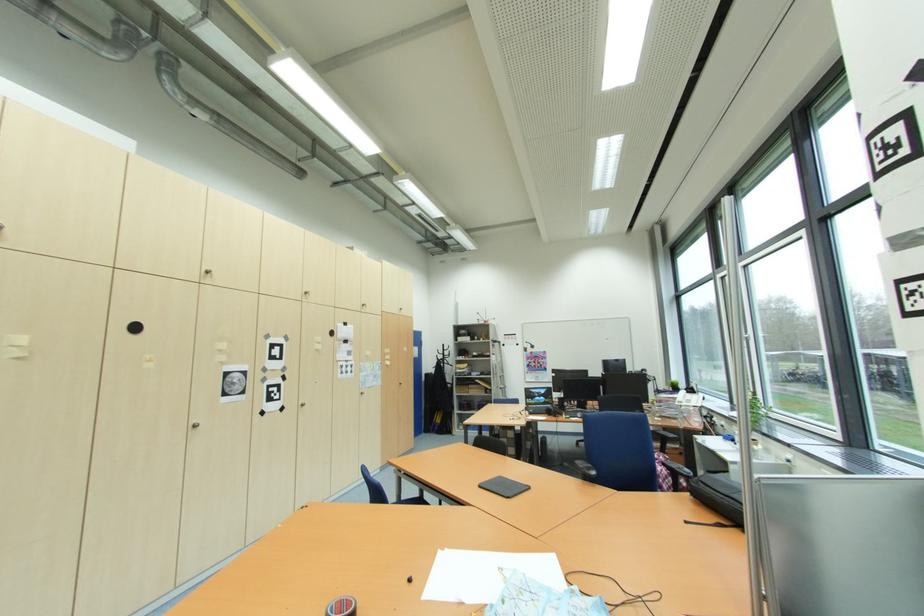
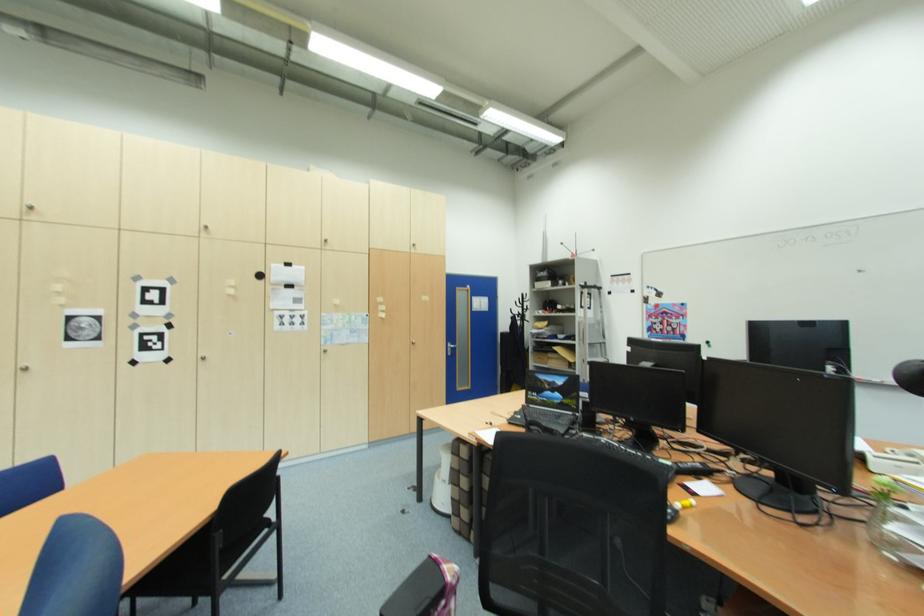
In the second image, find the point that corresponds to (x=493, y=361) in the first image.

(578, 317)